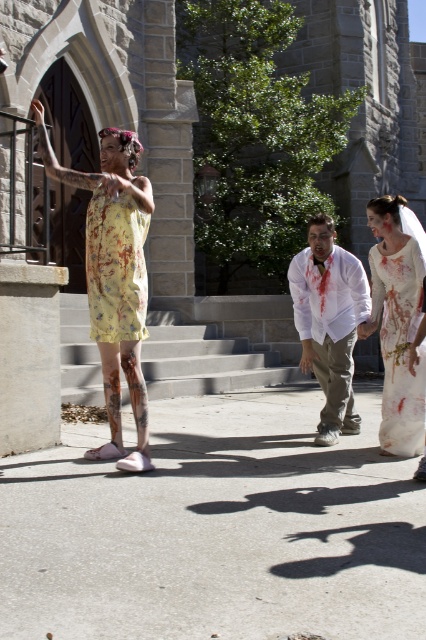
Is gray concrete stairs at center below white matte shirt at center?

Correct, gray concrete stairs at center is located below white matte shirt at center.

Locate an element on the screen. The width and height of the screenshot is (426, 640). gray concrete stairs at center is located at coordinates (206, 360).

Is the position of yellow printed dress at left less distant than that of floral-patterned fabric dress at left?

Yes, yellow printed dress at left is closer to the viewer.

Is point (57, 179) positioned in front of point (123, 257)?

No.

You are a GUI agent. You are given a task and a screenshot of the screen. Output one action in this format:
    pyautogui.click(x=<x>, y=<y>)
    Task: Click on the yellow printed dress at left
    Image resolution: width=426 pixels, height=640 pixels.
    Given the screenshot: What is the action you would take?
    pyautogui.click(x=114, y=275)

Is yellow printed dress at left bigger than gray concrete stairs at center?

Actually, yellow printed dress at left might be smaller than gray concrete stairs at center.

Which is in front, point (109, 266) or point (95, 394)?

Point (109, 266) is more forward.

What are the coordinates of `yellow printed dress at left` in the screenshot? It's located at pyautogui.click(x=114, y=275).